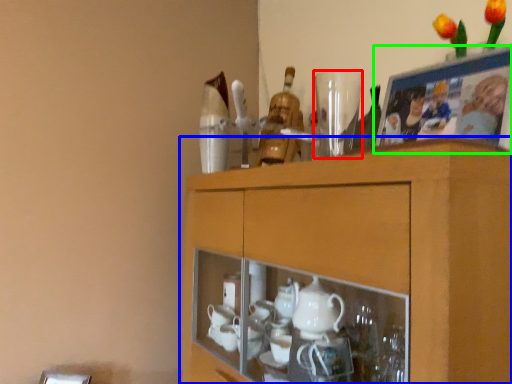
Question: Considering the real-world distances, which object is farthest from tableware (highlighted by a red box)? cabinetry (highlighted by a blue box) or picture frame (highlighted by a green box)?

Choices:
 (A) cabinetry
 (B) picture frame

Answer: (A)